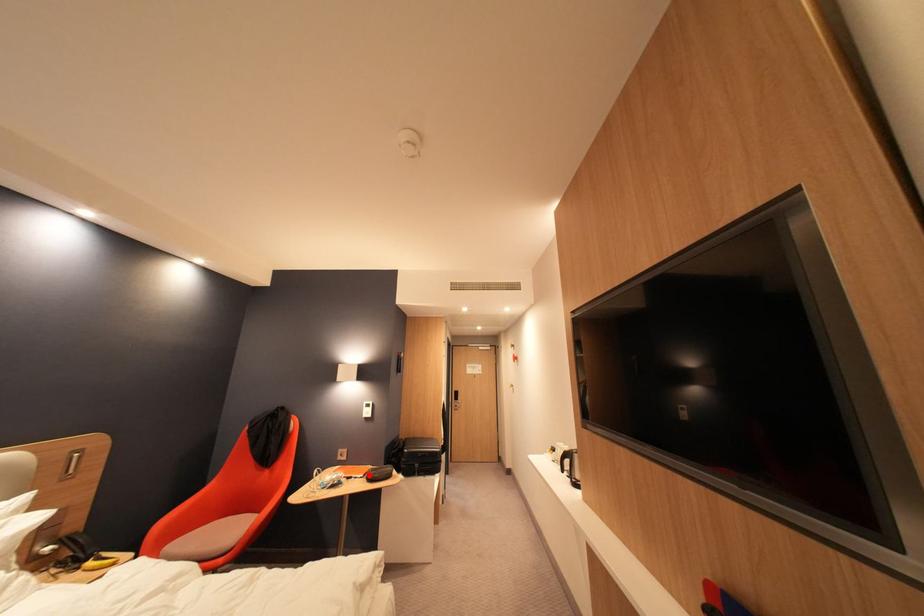
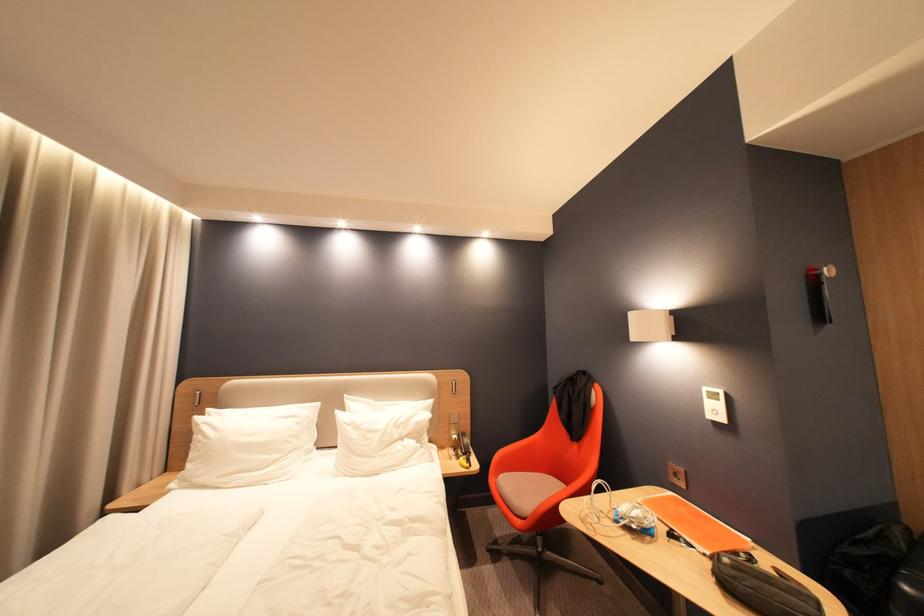
Question: I am providing you with two images of the same scene from different viewpoints. A red point is marked on the first image. Is the red point's position out of view in image 2?

Choices:
 (A) Yes
 (B) No

Answer: (B)